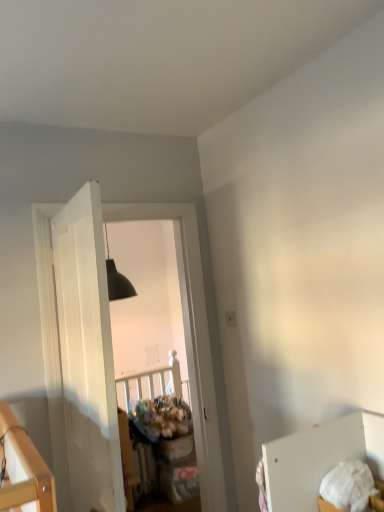
You are a GUI agent. You are given a task and a screenshot of the screen. Output one action in this format:
    pyautogui.click(x=<x>, y=<y>)
    Task: Click on the white glossy door at center
    
    Given the screenshot: What is the action you would take?
    87,353

Describe the element at coordinates (87, 353) in the screenshot. I see `white glossy door at center` at that location.

At what (x,y) coordinates should I click in order to perform the action: click on white glossy door at center. Please return your answer as a coordinate pair (x, y). Looking at the image, I should click on (87, 353).